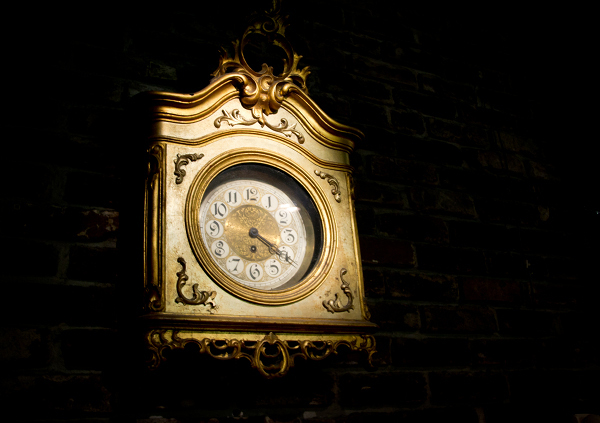
The height and width of the screenshot is (423, 600). I want to click on brick wall, so click(x=415, y=228).